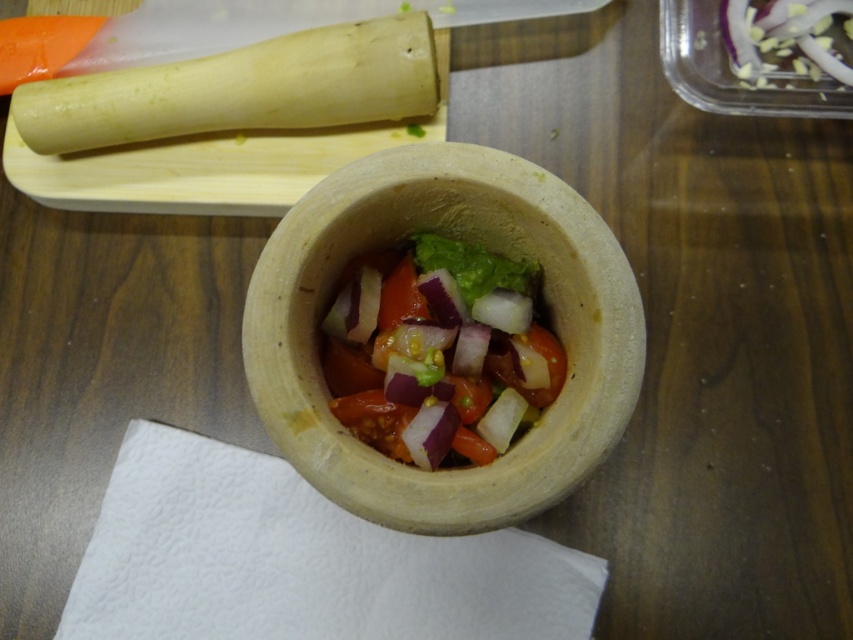
Based on the photo, you are preparing a salad and need to move the natural clay bowl at center to the wooden cutting board at upper left. Which direction should you move it?

The natural clay bowl at center is to the right of the wooden cutting board at upper left, so you should move it to the left to place it on the wooden cutting board at upper left.

Based on the photo, you are preparing a salad and need to choose a container. You have the natural clay bowl at center and the wooden cutting board at upper left. Which one is more suitable for holding the salad ingredients?

The natural clay bowl at center is more suitable for holding the salad ingredients because it is larger in size than the wooden cutting board at upper left, providing enough space to mix the vegetables.

In the scene shown: You are preparing a salad and need to know which occupies more space in the mortar. Which is wider, the vibrant fresh salad at center or the green leafy lettuce at center?

The vibrant fresh salad at center is wider than the green leafy lettuce at center.